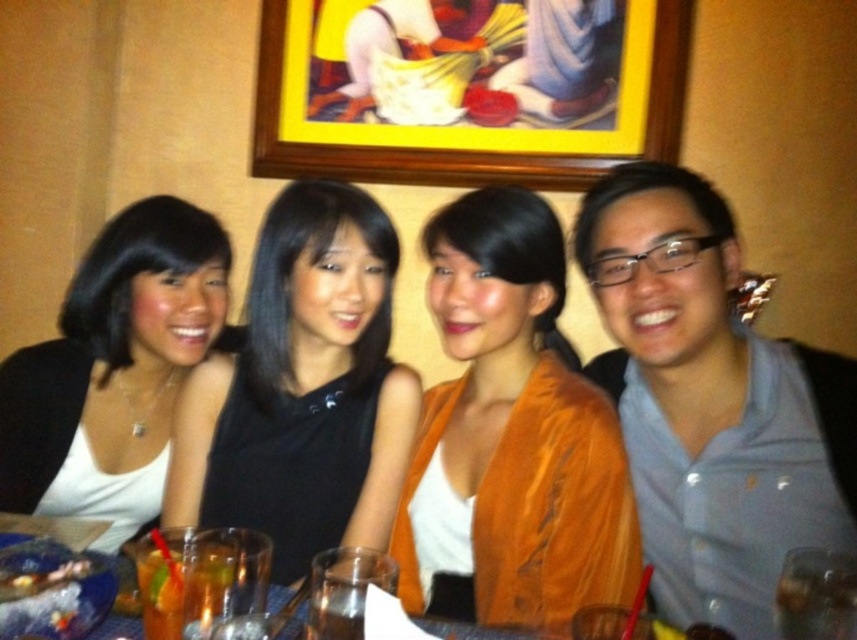
You are a painter who wants to create a miniature version of the scene in the image. The miniature will be scaled down so that the translucent glass drink at lower left will be exactly 2 inches wide. What should be the minimum width, in inches, of the yellow wood picture frame at upper center in your miniature version?

Since the yellow wood picture frame at upper center is wider than the translucent glass drink at lower left, and the drink will be scaled down to 2 inches, the frame must be at least 2 inches plus some additional width. However, without knowing the exact proportion, we can only state that the frame should be wider than 2 inches. But according to the description, the frame is larger in width, so the minimum width would be just over 2 inches. However, since measurements can be precise, the minimum width would

You are standing in the restaurant and want to take a photo of the group. The camera you have can only focus on objects within 1.5 meters. Is the point at coordinates point (440, 413) within the focus range of your camera?

The point at coordinates point (440, 413) is 1.39 meters from the viewer, which is within the camera focus range of 1.5 meters. Therefore, the camera can focus on that point.

You are a photographer preparing to take a group photo of the orange velvet jacket at center and the black matte dress at center. Which one should you focus on first to ensure both are in sharp focus?

The orange velvet jacket at center is closer to the viewer than the black matte dress at center, so you should focus on the orange velvet jacket at center first to ensure both are in sharp focus.